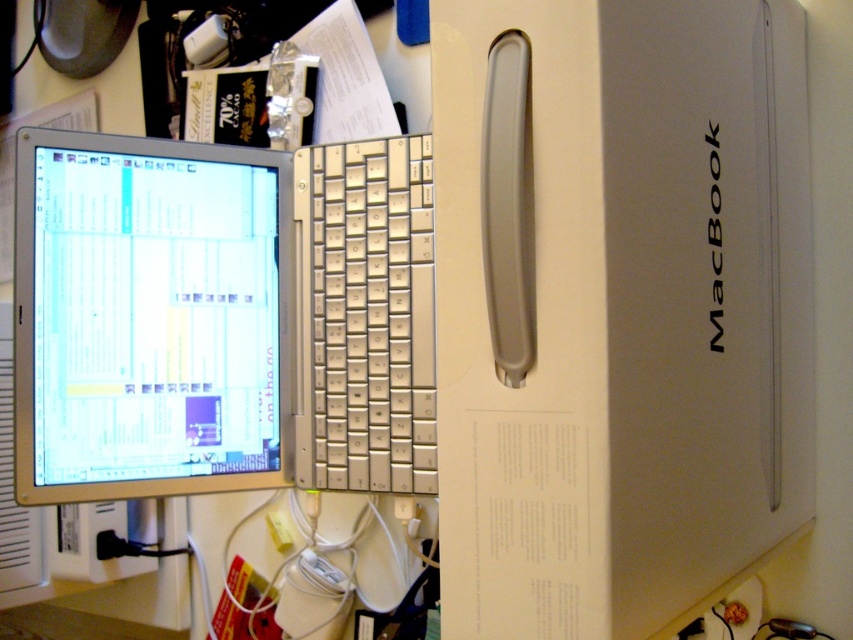
Which is more to the right, silver metallic computer monitor at center or silver metallic keyboard at center?

silver metallic keyboard at center is more to the right.

Who is more distant from viewer, (x=100, y=301) or (x=396, y=220)?

Positioned behind is point (x=396, y=220).

Where is `silver metallic computer monitor at center`? silver metallic computer monitor at center is located at coordinates (149, 317).

Who is higher up, silver metallic macbook at center or silver metallic keyboard at center?

silver metallic macbook at center is higher up.

Can you confirm if silver metallic macbook at center is positioned to the left of silver metallic keyboard at center?

No, silver metallic macbook at center is not to the left of silver metallic keyboard at center.

Identify the location of silver metallic macbook at center. (618, 307).

The width and height of the screenshot is (853, 640). Identify the location of silver metallic macbook at center. (618, 307).

Does silver metallic macbook at center appear on the left side of silver metallic computer monitor at center?

No, silver metallic macbook at center is not to the left of silver metallic computer monitor at center.

Is silver metallic macbook at center smaller than silver metallic computer monitor at center?

No.

Measure the distance between silver metallic macbook at center and camera.

A distance of 20.43 inches exists between silver metallic macbook at center and camera.

Where is `silver metallic macbook at center`? silver metallic macbook at center is located at coordinates (618, 307).